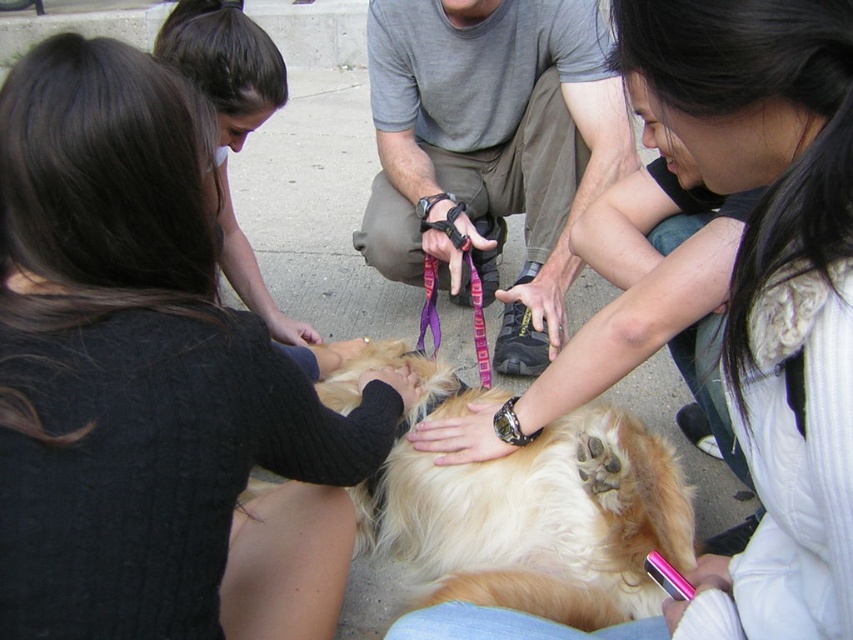
You are a fashion designer observing the scene. You need to determine which object has a greater width for a design project. Which one is wider between the black sweater at center and the smooth brown hair at upper left?

The black sweater at center is wider than the smooth brown hair at upper left according to the description.

Where is the fluffy golden fur at center positioned in the image?

The fluffy golden fur at center is positioned at coordinates point (755,307).